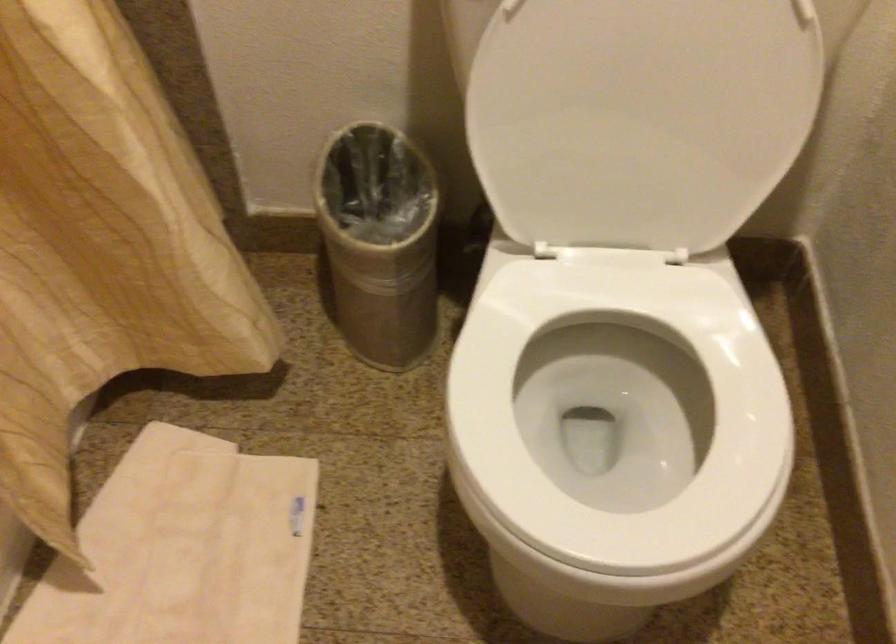
Locate an element on the screen. The image size is (896, 644). white toilet lid is located at coordinates (640, 118).